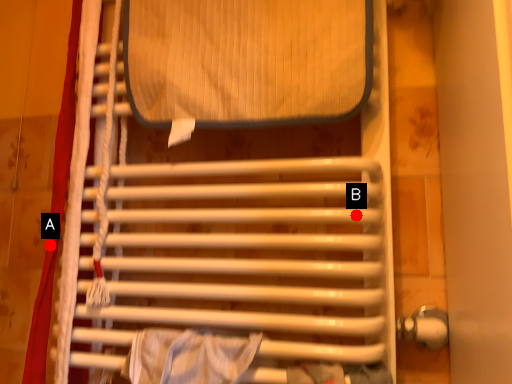
Question: Two points are circled on the image, labeled by A and B beside each circle. Which of the following is the closest to the observer?

Choices:
 (A) A is closer
 (B) B is closer

Answer: (B)